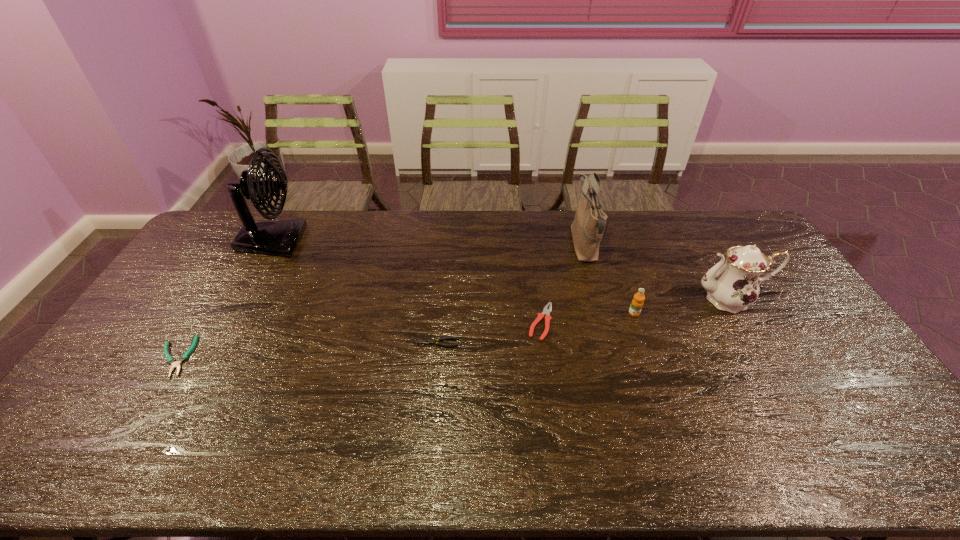
What are the coordinates of `the second shortest pliers` in the screenshot? It's located at (428, 341).

At what (x,y) coordinates should I click in order to perform the action: click on the shortest object. Please return your answer as a coordinate pair (x, y). Looking at the image, I should click on coord(170,360).

I want to click on the leftmost pliers, so click(x=170, y=360).

Where is `vacant region located 0.190m in front of the fan to blow air`? The image size is (960, 540). vacant region located 0.190m in front of the fan to blow air is located at coordinates (356, 241).

Image resolution: width=960 pixels, height=540 pixels. I want to click on vacant area situated 0.220m on the front-facing side of the third object from right to left, so tap(510, 246).

You are a GUI agent. You are given a task and a screenshot of the screen. Output one action in this format:
    pyautogui.click(x=<x>, y=<y>)
    Task: Click on the free space located 0.340m on the front-facing side of the third object from right to left
    The height and width of the screenshot is (540, 960).
    Given the screenshot: What is the action you would take?
    pyautogui.click(x=476, y=246)

At what (x,y) coordinates should I click in order to perform the action: click on blank space located 0.190m on the front-facing side of the third object from right to left. Please return your answer as a coordinate pair (x, y). The width and height of the screenshot is (960, 540). Looking at the image, I should click on (517, 246).

In order to click on vacant space positioned on the front of the rightmost object in this screenshot , I will do coord(793,410).

What are the coordinates of `free region located on the label of the sixth object from left to right` in the screenshot? It's located at (660, 387).

Where is `vacant space located 0.100m on the left of the fourth object from left to right`? vacant space located 0.100m on the left of the fourth object from left to right is located at coordinates (494, 322).